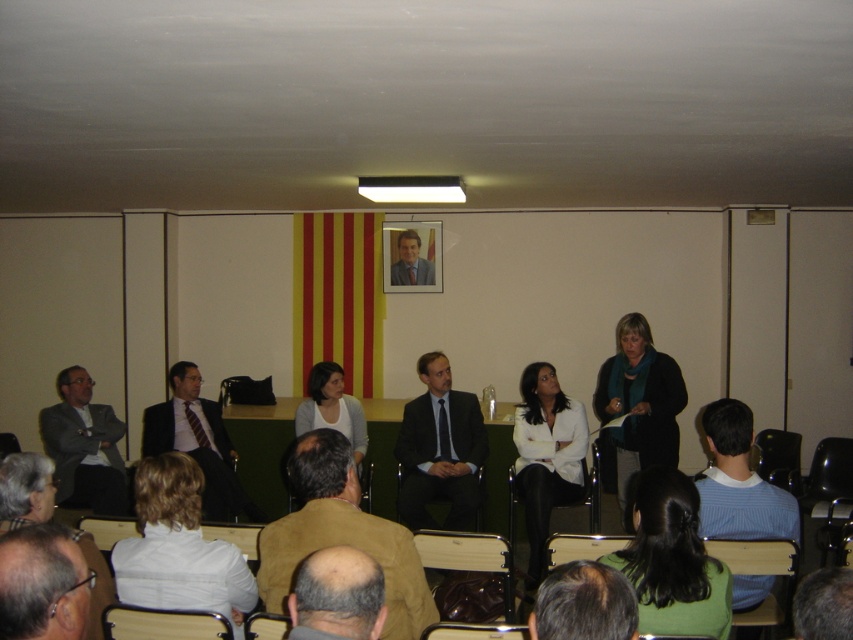
Question: Estimate the real-world distances between objects in this image. Which object is farther from the dark blue sweater at center?

Choices:
 (A) dark suit at center
 (B) brown leather jacket at center
 (C) bald head at lower center
 (D) smooth black suit at center

Answer: (C)

Question: Does dark blue sweater at center have a greater width compared to dark brown hair at lower center?

Choices:
 (A) yes
 (B) no

Answer: (A)

Question: Which is farther from the gray hair at lower left?

Choices:
 (A) white shirt at lower left
 (B) dark brown hair at lower center
 (C) matte black suit at left

Answer: (C)

Question: Which point is closer to the camera?

Choices:
 (A) white shirt at center
 (B) white shirt at lower left

Answer: (B)

Question: Does green fabric hair at lower center appear on the left side of matte gray suit at left?

Choices:
 (A) yes
 (B) no

Answer: (B)

Question: Can you confirm if dark blue sweater at center is smaller than blue striped sweater at lower right?

Choices:
 (A) yes
 (B) no

Answer: (B)